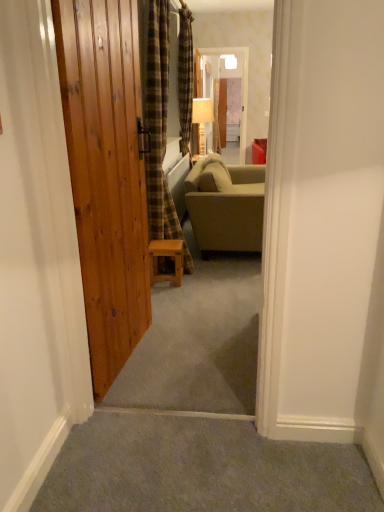
Question: Considering the positions of wooden textured lamp at center and natural wood door at left in the image, is wooden textured lamp at center taller or shorter than natural wood door at left?

Choices:
 (A) tall
 (B) short

Answer: (B)

Question: Relative to natural wood door at left, is wooden textured lamp at center in front or behind?

Choices:
 (A) behind
 (B) front

Answer: (A)

Question: Considering the real-world distances, which object is farthest from the wooden textured lamp at center?

Choices:
 (A) translucent plastic screen door at center
 (B) plaid fabric curtain at center, which is the second curtain from back to front
 (C) natural wood door at left
 (D) plaid fabric curtain at center, the second curtain viewed from the front
 (E) matte beige couch at center

Answer: (C)

Question: Which object is the farthest from the plaid fabric curtain at center, which is the 1th curtain in front-to-back order?

Choices:
 (A) wooden textured lamp at center
 (B) matte beige couch at center
 (C) plaid fabric curtain at center, the first curtain viewed from the back
 (D) natural wood door at left
 (E) translucent plastic screen door at center

Answer: (E)